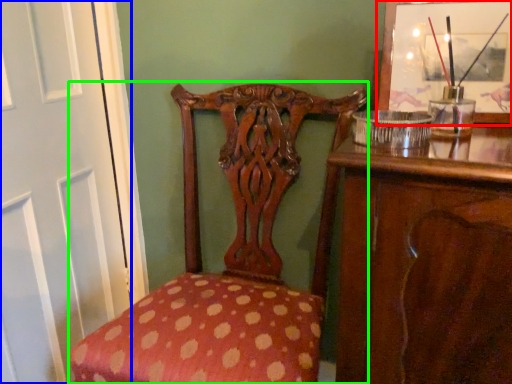
Question: Which object is positioned farthest from picture frame (highlighted by a red box)? Select from screen door (highlighted by a blue box) and chair (highlighted by a green box).

Choices:
 (A) screen door
 (B) chair

Answer: (A)